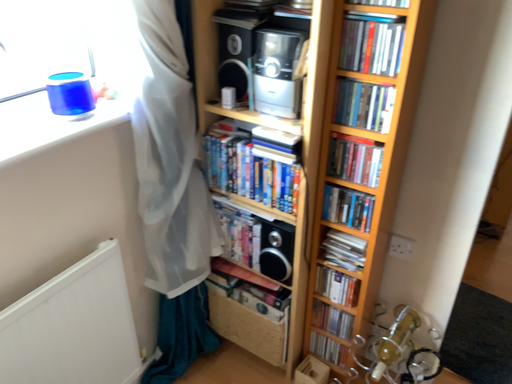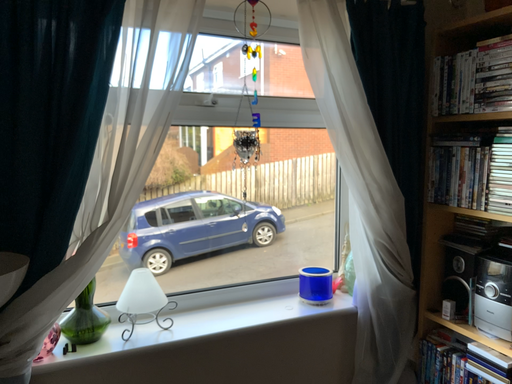
Question: How did the camera likely rotate when shooting the video?

Choices:
 (A) rotated right
 (B) rotated left

Answer: (B)